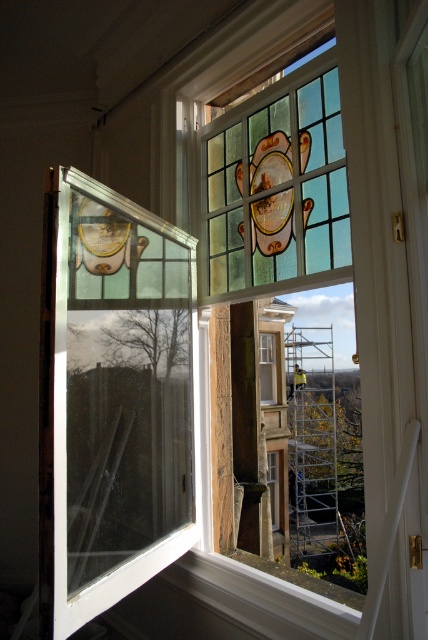
Between point (140, 509) and point (265, 368), which one is positioned behind?

Positioned behind is point (265, 368).

Is clear glass window at left above stained glass window at center?

Correct, clear glass window at left is located above stained glass window at center.

Does point (140, 205) come closer to viewer compared to point (270, 346)?

Yes.

Where is `clear glass window at left`? The width and height of the screenshot is (428, 640). clear glass window at left is located at coordinates (112, 400).

Can you confirm if stained glass window at center is taller than clear glass window at center?

No.

Can you confirm if stained glass window at center is positioned to the left of clear glass window at center?

Correct, you'll find stained glass window at center to the left of clear glass window at center.

Is point (262, 358) behind point (270, 480)?

Yes.

Find the location of a particular element. The height and width of the screenshot is (640, 428). stained glass window at center is located at coordinates (269, 368).

Between silver metallic scaffolding at center and stained glass window at center, which one appears on the left side from the viewer's perspective?

stained glass window at center is more to the left.

Is silver metallic scaffolding at center in front of stained glass window at center?

No, it is not.

Locate an element on the screen. silver metallic scaffolding at center is located at coordinates (312, 451).